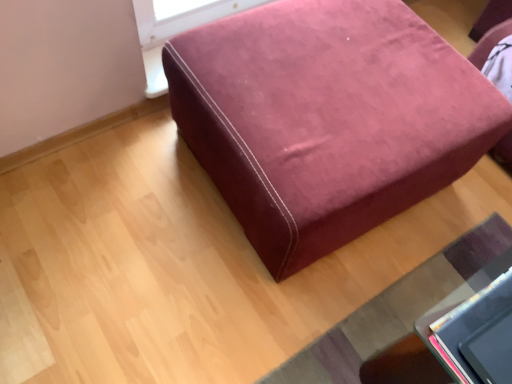
Where is `velvet-like burgundy ottoman at center`? This screenshot has width=512, height=384. velvet-like burgundy ottoman at center is located at coordinates (327, 119).

This screenshot has width=512, height=384. Describe the element at coordinates (327, 119) in the screenshot. I see `velvet-like burgundy ottoman at center` at that location.

The width and height of the screenshot is (512, 384). Find the location of `velvet-like burgundy ottoman at lower right`. velvet-like burgundy ottoman at lower right is located at coordinates (402, 316).

What do you see at coordinates (402, 316) in the screenshot?
I see `velvet-like burgundy ottoman at lower right` at bounding box center [402, 316].

I want to click on velvet-like burgundy ottoman at center, so click(x=327, y=119).

Is velvet-like burgundy ottoman at lower right to the left of velvet-like burgundy ottoman at center from the viewer's perspective?

Incorrect, velvet-like burgundy ottoman at lower right is not on the left side of velvet-like burgundy ottoman at center.

Which object is closer to the camera, velvet-like burgundy ottoman at lower right or velvet-like burgundy ottoman at center?

velvet-like burgundy ottoman at center is more forward.

Is point (439, 379) positioned after point (374, 78)?

No, it is in front of (374, 78).

From the image's perspective, is velvet-like burgundy ottoman at lower right above or below velvet-like burgundy ottoman at center?

velvet-like burgundy ottoman at lower right is situated lower than velvet-like burgundy ottoman at center in the image.

From a real-world perspective, is velvet-like burgundy ottoman at lower right physically above velvet-like burgundy ottoman at center?

Actually, velvet-like burgundy ottoman at lower right is physically below velvet-like burgundy ottoman at center in the real world.

Between velvet-like burgundy ottoman at lower right and velvet-like burgundy ottoman at center, which one has larger width?

velvet-like burgundy ottoman at center is wider.

From the picture: Considering the sizes of velvet-like burgundy ottoman at lower right and velvet-like burgundy ottoman at center in the image, is velvet-like burgundy ottoman at lower right taller or shorter than velvet-like burgundy ottoman at center?

Considering their sizes, velvet-like burgundy ottoman at lower right has less height than velvet-like burgundy ottoman at center.

Considering the relative sizes of velvet-like burgundy ottoman at lower right and velvet-like burgundy ottoman at center in the image provided, is velvet-like burgundy ottoman at lower right smaller than velvet-like burgundy ottoman at center?

Indeed, velvet-like burgundy ottoman at lower right has a smaller size compared to velvet-like burgundy ottoman at center.

Is velvet-like burgundy ottoman at lower right surrounding velvet-like burgundy ottoman at center?

No, velvet-like burgundy ottoman at center is not a part of velvet-like burgundy ottoman at lower right.

Is velvet-like burgundy ottoman at lower right positioned far away from velvet-like burgundy ottoman at center?

Actually, velvet-like burgundy ottoman at lower right and velvet-like burgundy ottoman at center are a little close together.

Is velvet-like burgundy ottoman at center at the back of velvet-like burgundy ottoman at lower right?

Correct, velvet-like burgundy ottoman at lower right is looking away from velvet-like burgundy ottoman at center.

How much distance is there between velvet-like burgundy ottoman at lower right and velvet-like burgundy ottoman at center?

velvet-like burgundy ottoman at lower right is 19.43 inches from velvet-like burgundy ottoman at center.

Find the location of `furniture to the left of velvet-like burgundy ottoman at lower right`. furniture to the left of velvet-like burgundy ottoman at lower right is located at coordinates (327, 119).

Is velvet-like burgundy ottoman at center to the left or to the right of velvet-like burgundy ottoman at lower right in the image?

velvet-like burgundy ottoman at center is positioned on velvet-like burgundy ottoman at lower right's left side.

Which object is further away from the camera taking this photo, velvet-like burgundy ottoman at center or velvet-like burgundy ottoman at lower right?

velvet-like burgundy ottoman at lower right is further away from the camera.

Does point (243, 186) lie in front of point (357, 321)?

Yes, point (243, 186) is in front of point (357, 321).

From the image's perspective, is velvet-like burgundy ottoman at center on top of velvet-like burgundy ottoman at lower right?

Yes, from the image's perspective, velvet-like burgundy ottoman at center is above velvet-like burgundy ottoman at lower right.

From a real-world perspective, which object stands above the other?

velvet-like burgundy ottoman at center.

Which of these two, velvet-like burgundy ottoman at center or velvet-like burgundy ottoman at lower right, is wider?

With larger width is velvet-like burgundy ottoman at center.

Between velvet-like burgundy ottoman at center and velvet-like burgundy ottoman at lower right, which one has more height?

With more height is velvet-like burgundy ottoman at center.

In the scene shown: Considering the relative sizes of velvet-like burgundy ottoman at center and velvet-like burgundy ottoman at lower right in the image provided, is velvet-like burgundy ottoman at center bigger than velvet-like burgundy ottoman at lower right?

Indeed, velvet-like burgundy ottoman at center has a larger size compared to velvet-like burgundy ottoman at lower right.

Is velvet-like burgundy ottoman at lower right completely or partially inside velvet-like burgundy ottoman at center?

Definitely not — velvet-like burgundy ottoman at lower right is not inside velvet-like burgundy ottoman at center.

Is velvet-like burgundy ottoman at center not near velvet-like burgundy ottoman at lower right?

No, velvet-like burgundy ottoman at center is in close proximity to velvet-like burgundy ottoman at lower right.

Is velvet-like burgundy ottoman at center aimed at velvet-like burgundy ottoman at lower right?

Yes, velvet-like burgundy ottoman at center is facing velvet-like burgundy ottoman at lower right.

You are a GUI agent. You are given a task and a screenshot of the screen. Output one action in this format:
    pyautogui.click(x=<x>, y=<y>)
    Task: Click on the furniture above the velvet-like burgundy ottoman at lower right (from the image's perspective)
    Image resolution: width=512 pixels, height=384 pixels.
    Given the screenshot: What is the action you would take?
    pyautogui.click(x=327, y=119)

The width and height of the screenshot is (512, 384). In the image, there is a velvet-like burgundy ottoman at center. What are the coordinates of `mat below it (from the image's perspective)` in the screenshot? It's located at pyautogui.click(x=402, y=316).

This screenshot has height=384, width=512. What are the coordinates of `furniture in front of the velvet-like burgundy ottoman at lower right` in the screenshot? It's located at (327, 119).